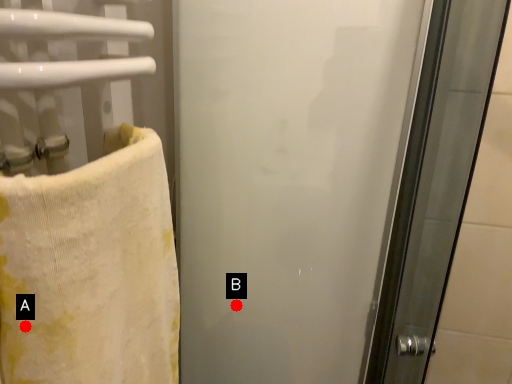
Question: Two points are circled on the image, labeled by A and B beside each circle. Which of the following is the closest to the observer?

Choices:
 (A) A is closer
 (B) B is closer

Answer: (A)